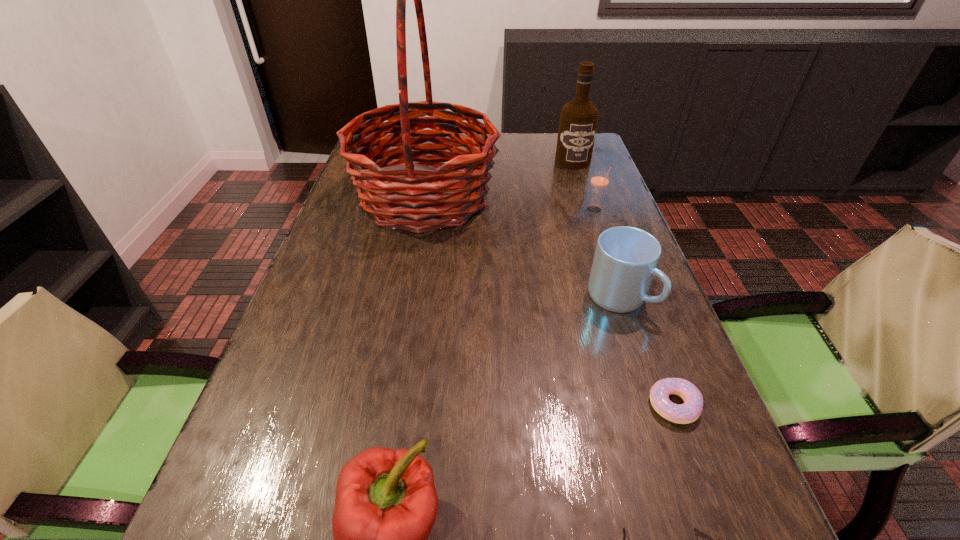
Locate an element on the screen. The width and height of the screenshot is (960, 540). basket located in the far edge section of the desktop is located at coordinates (456, 187).

I want to click on alcohol located at the far edge, so click(x=578, y=122).

This screenshot has width=960, height=540. Identify the location of object at the left edge. (456, 187).

At what (x,y) coordinates should I click in order to perform the action: click on alcohol located at the right edge. Please return your answer as a coordinate pair (x, y). This screenshot has height=540, width=960. Looking at the image, I should click on (578, 122).

Where is `straw present at the right edge`? straw present at the right edge is located at coordinates (599, 181).

Identify the location of mug located in the right edge section of the desktop. (625, 261).

Identify the location of doughnut at the right edge. The height and width of the screenshot is (540, 960). (688, 412).

The height and width of the screenshot is (540, 960). What are the coordinates of `object that is positioned at the far left corner` in the screenshot? It's located at (456, 187).

Where is `object located at the far right corner`? The image size is (960, 540). object located at the far right corner is located at coordinates (578, 122).

Image resolution: width=960 pixels, height=540 pixels. In the image, there is a desktop. What are the coordinates of `vacant space at the left edge` in the screenshot? It's located at (352, 187).